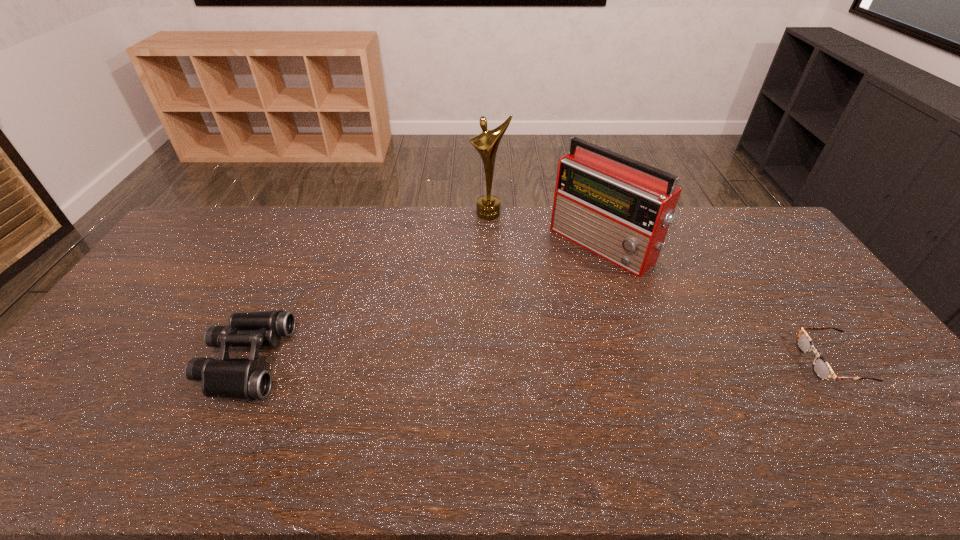
At what (x,y) coordinates should I click in order to perform the action: click on free spot between the shortest object and the second object from right to left. Please return your answer as a coordinate pair (x, y). This screenshot has height=540, width=960. Looking at the image, I should click on (717, 303).

This screenshot has height=540, width=960. I want to click on vacant region between the shortest object and the award, so click(x=660, y=287).

Where is `free spot between the award and the leftmost object`? The image size is (960, 540). free spot between the award and the leftmost object is located at coordinates (367, 287).

The height and width of the screenshot is (540, 960). I want to click on empty location between the second object from left to right and the radio receiver, so click(545, 229).

Select which object appears as the second closest to the second object from right to left. Please provide its 2D coordinates. Your answer should be formatted as a tuple, i.e. [(x, y)], where the tuple contains the x and y coordinates of a point satisfying the conditions above.

[(821, 368)]

Where is `object that ranks as the closest to the shortest object`? object that ranks as the closest to the shortest object is located at coordinates (620, 209).

Locate an element on the screen. This screenshot has height=540, width=960. vacant position in the image that satisfies the following two spatial constraints: 1. on the front side of the spectacles; 2. on the frame of the third object from right to left is located at coordinates pyautogui.click(x=493, y=362).

The image size is (960, 540). I want to click on free spot that satisfies the following two spatial constraints: 1. on the front side of the spectacles; 2. on the frame of the third object from right to left, so click(493, 362).